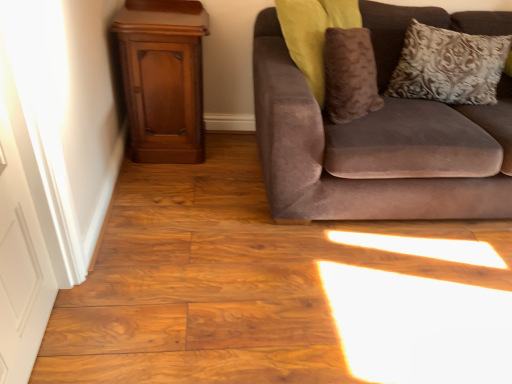
Locate an element on the screen. The width and height of the screenshot is (512, 384). free location to the right of mahogany wood dresser at left is located at coordinates (231, 161).